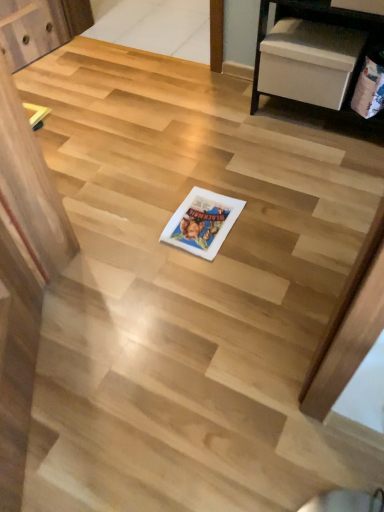
Question: From a real-world perspective, is white paper comic book at center, the 2th comic book in the right-to-left sequence, under matte paper comic book at right, the 2th comic book when ordered from bottom to top?

Choices:
 (A) yes
 (B) no

Answer: (A)

Question: Considering the relative sizes of white paper comic book at center, which ranks as the first comic book in bottom-to-top order, and matte paper comic book at right, which is the 1th comic book from top to bottom, in the image provided, is white paper comic book at center, which ranks as the first comic book in bottom-to-top order, smaller than matte paper comic book at right, which is the 1th comic book from top to bottom,?

Choices:
 (A) yes
 (B) no

Answer: (A)

Question: From the image's perspective, is white paper comic book at center, which is counted as the 1th comic book, starting from the left, located beneath matte paper comic book at right, the 1th comic book in the right-to-left sequence?

Choices:
 (A) no
 (B) yes

Answer: (B)

Question: Would you say white paper comic book at center, the 2th comic book when ordered from top to bottom, contains matte paper comic book at right, the 1th comic book in the right-to-left sequence?

Choices:
 (A) no
 (B) yes

Answer: (A)

Question: Can you confirm if white paper comic book at center, the 2th comic book when ordered from top to bottom, is shorter than matte paper comic book at right, the 2th comic book when ordered from bottom to top?

Choices:
 (A) yes
 (B) no

Answer: (A)

Question: Is white paper comic book at center, the 2th comic book when ordered from top to bottom, bigger than matte paper comic book at right, the 2th comic book when ordered from bottom to top?

Choices:
 (A) no
 (B) yes

Answer: (A)

Question: Are matte paper comic book at right, positioned as the second comic book in left-to-right order, and white paper comic book at center, the 2th comic book when ordered from top to bottom, beside each other?

Choices:
 (A) yes
 (B) no

Answer: (B)

Question: Considering the relative positions of matte paper comic book at right, positioned as the second comic book in left-to-right order, and white paper comic book at center, which is counted as the 1th comic book, starting from the left, in the image provided, is matte paper comic book at right, positioned as the second comic book in left-to-right order, behind white paper comic book at center, which is counted as the 1th comic book, starting from the left,?

Choices:
 (A) yes
 (B) no

Answer: (A)

Question: Can you confirm if matte paper comic book at right, the 2th comic book when ordered from bottom to top, is thinner than white paper comic book at center, the 2th comic book when ordered from top to bottom?

Choices:
 (A) yes
 (B) no

Answer: (A)

Question: Can white paper comic book at center, which ranks as the first comic book in bottom-to-top order, be found inside matte paper comic book at right, which is the 1th comic book from top to bottom?

Choices:
 (A) no
 (B) yes

Answer: (A)

Question: Is matte paper comic book at right, which is the 1th comic book from top to bottom, far away from white paper comic book at center, the 2th comic book when ordered from top to bottom?

Choices:
 (A) yes
 (B) no

Answer: (B)

Question: Is matte paper comic book at right, the 2th comic book when ordered from bottom to top, outside of white paper comic book at center, which ranks as the first comic book in bottom-to-top order?

Choices:
 (A) yes
 (B) no

Answer: (A)

Question: In terms of height, does white paper comic book at center, which ranks as the first comic book in bottom-to-top order, look taller or shorter compared to matte paper comic book at right, positioned as the second comic book in left-to-right order?

Choices:
 (A) tall
 (B) short

Answer: (B)